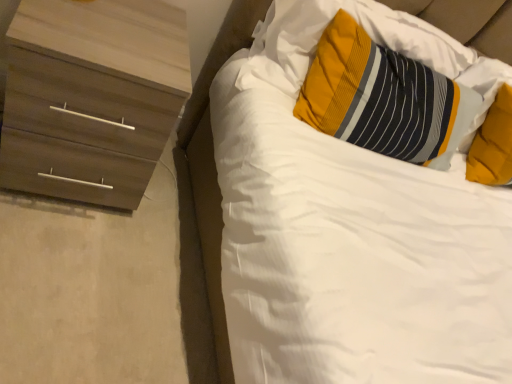
What do you see at coordinates (493, 144) in the screenshot? The width and height of the screenshot is (512, 384). I see `soft yellow pillow at upper right, which appears as the second pillow when viewed from the left` at bounding box center [493, 144].

Looking at this image, what is the approximate height of wooden chest of drawers at left?

wooden chest of drawers at left is 20.02 inches tall.

This screenshot has height=384, width=512. I want to click on white soft bed at upper right, so click(214, 164).

What do you see at coordinates (214, 164) in the screenshot?
I see `white soft bed at upper right` at bounding box center [214, 164].

Locate an element on the screen. The width and height of the screenshot is (512, 384). soft yellow pillow at upper right, which appears as the second pillow when viewed from the left is located at coordinates (493, 144).

How many degrees apart are the facing directions of soft yellow pillow at upper right, marked as the first pillow in a right-to-left arrangement, and white soft bed at upper right?

The angular difference between soft yellow pillow at upper right, marked as the first pillow in a right-to-left arrangement, and white soft bed at upper right is 5.76 degrees.

From a real-world perspective, between soft yellow pillow at upper right, which appears as the second pillow when viewed from the left, and white soft bed at upper right, who is vertically higher?

soft yellow pillow at upper right, which appears as the second pillow when viewed from the left, is physically above.

Is soft yellow pillow at upper right, marked as the first pillow in a right-to-left arrangement, facing away from white soft bed at upper right?

No.

Which object is more forward, soft yellow pillow at upper right, marked as the first pillow in a right-to-left arrangement, or white soft bed at upper right?

white soft bed at upper right is closer to the camera.

Which is in front, point (362, 78) or point (185, 143)?

The point (362, 78) is closer.

From a real-world perspective, is striped fabric pillow at upper right, which appears as the 1th pillow when viewed from the left, positioned under white soft bed at upper right based on gravity?

Actually, striped fabric pillow at upper right, which appears as the 1th pillow when viewed from the left, is physically above white soft bed at upper right in the real world.

Considering the relative sizes of striped fabric pillow at upper right, the second pillow when ordered from right to left, and white soft bed at upper right in the image provided, is striped fabric pillow at upper right, the second pillow when ordered from right to left, taller than white soft bed at upper right?

Incorrect, the height of striped fabric pillow at upper right, the second pillow when ordered from right to left, is not larger of that of white soft bed at upper right.

Considering the positions of objects striped fabric pillow at upper right, which appears as the 1th pillow when viewed from the left, and white soft bed at upper right in the image provided, who is more to the left, striped fabric pillow at upper right, which appears as the 1th pillow when viewed from the left, or white soft bed at upper right?

white soft bed at upper right.

Which point is more forward, (433, 92) or (480, 147)?

The point (433, 92) is closer to the camera.

How far apart are striped fabric pillow at upper right, which appears as the 1th pillow when viewed from the left, and soft yellow pillow at upper right, marked as the first pillow in a right-to-left arrangement?

A distance of 13.65 inches exists between striped fabric pillow at upper right, which appears as the 1th pillow when viewed from the left, and soft yellow pillow at upper right, marked as the first pillow in a right-to-left arrangement.

Consider the image. Is striped fabric pillow at upper right, which appears as the 1th pillow when viewed from the left, outside of soft yellow pillow at upper right, which appears as the second pillow when viewed from the left?

That's correct, striped fabric pillow at upper right, which appears as the 1th pillow when viewed from the left, is outside of soft yellow pillow at upper right, which appears as the second pillow when viewed from the left.

Which point is more forward, (73, 155) or (198, 87)?

The point (73, 155) is more forward.

Can you confirm if wooden chest of drawers at left is bigger than white soft bed at upper right?

Actually, wooden chest of drawers at left might be smaller than white soft bed at upper right.

Which is more to the right, wooden chest of drawers at left or white soft bed at upper right?

From the viewer's perspective, white soft bed at upper right appears more on the right side.

From the image's perspective, which one is positioned lower, wooden chest of drawers at left or white soft bed at upper right?

From the image's view, white soft bed at upper right is below.

Is white soft bed at upper right at the left side of soft yellow pillow at upper right, marked as the first pillow in a right-to-left arrangement?

Yes.

Does white soft bed at upper right come in front of soft yellow pillow at upper right, which appears as the second pillow when viewed from the left?

Yes, it is.

Is soft yellow pillow at upper right, which appears as the second pillow when viewed from the left, at the back of white soft bed at upper right?

No.

Is white soft bed at upper right completely or partially outside of soft yellow pillow at upper right, which appears as the second pillow when viewed from the left?

Indeed, white soft bed at upper right is completely outside soft yellow pillow at upper right, which appears as the second pillow when viewed from the left.

Which of these two, soft yellow pillow at upper right, which appears as the second pillow when viewed from the left, or wooden chest of drawers at left, is wider?

wooden chest of drawers at left is wider.

Does point (507, 101) lie in front of point (146, 135)?

No, (507, 101) is behind (146, 135).

Considering the sizes of objects soft yellow pillow at upper right, which appears as the second pillow when viewed from the left, and wooden chest of drawers at left in the image provided, who is taller, soft yellow pillow at upper right, which appears as the second pillow when viewed from the left, or wooden chest of drawers at left?

wooden chest of drawers at left is taller.

The height and width of the screenshot is (384, 512). In order to click on the chest of drawers in front of the soft yellow pillow at upper right, which appears as the second pillow when viewed from the left in this screenshot , I will do 91,97.

Is striped fabric pillow at upper right, which appears as the 1th pillow when viewed from the left, next to wooden chest of drawers at left?

No, striped fabric pillow at upper right, which appears as the 1th pillow when viewed from the left, is not in contact with wooden chest of drawers at left.

Can you confirm if striped fabric pillow at upper right, which appears as the 1th pillow when viewed from the left, is positioned to the left of wooden chest of drawers at left?

No, striped fabric pillow at upper right, which appears as the 1th pillow when viewed from the left, is not to the left of wooden chest of drawers at left.

Looking at this image, can you confirm if striped fabric pillow at upper right, which appears as the 1th pillow when viewed from the left, is bigger than wooden chest of drawers at left?

No, striped fabric pillow at upper right, which appears as the 1th pillow when viewed from the left, is not bigger than wooden chest of drawers at left.

How different are the orientations of striped fabric pillow at upper right, the second pillow when ordered from right to left, and wooden chest of drawers at left in degrees?

striped fabric pillow at upper right, the second pillow when ordered from right to left, and wooden chest of drawers at left are facing 4.76 degrees away from each other.

Where is `bed that appears below the soft yellow pillow at upper right, which appears as the second pillow when viewed from the left (from a real-world perspective)`? This screenshot has height=384, width=512. bed that appears below the soft yellow pillow at upper right, which appears as the second pillow when viewed from the left (from a real-world perspective) is located at coordinates coord(214,164).

Find the location of a particular element. Image resolution: width=512 pixels, height=384 pixels. bed on the left of striped fabric pillow at upper right, the second pillow when ordered from right to left is located at coordinates (214, 164).

Which object lies nearer to the anchor point soft yellow pillow at upper right, marked as the first pillow in a right-to-left arrangement, striped fabric pillow at upper right, the second pillow when ordered from right to left, or white soft bed at upper right?

Among the two, striped fabric pillow at upper right, the second pillow when ordered from right to left, is located nearer to soft yellow pillow at upper right, marked as the first pillow in a right-to-left arrangement.

Consider the image. Considering their positions, is soft yellow pillow at upper right, which appears as the second pillow when viewed from the left, positioned further to striped fabric pillow at upper right, the second pillow when ordered from right to left, than wooden chest of drawers at left?

wooden chest of drawers at left lies further to striped fabric pillow at upper right, the second pillow when ordered from right to left, than the other object.

Based on their spatial positions, is white soft bed at upper right or soft yellow pillow at upper right, which appears as the second pillow when viewed from the left, further from wooden chest of drawers at left?

soft yellow pillow at upper right, which appears as the second pillow when viewed from the left, is further to wooden chest of drawers at left.

Considering their positions, is soft yellow pillow at upper right, which appears as the second pillow when viewed from the left, positioned further to wooden chest of drawers at left than striped fabric pillow at upper right, the second pillow when ordered from right to left?

soft yellow pillow at upper right, which appears as the second pillow when viewed from the left, is further to wooden chest of drawers at left.

Estimate the real-world distances between objects in this image. Which object is closer to white soft bed at upper right, soft yellow pillow at upper right, which appears as the second pillow when viewed from the left, or striped fabric pillow at upper right, which appears as the 1th pillow when viewed from the left?

striped fabric pillow at upper right, which appears as the 1th pillow when viewed from the left, is closer to white soft bed at upper right.

Which object lies nearer to the anchor point white soft bed at upper right, striped fabric pillow at upper right, the second pillow when ordered from right to left, or wooden chest of drawers at left?

wooden chest of drawers at left.

When comparing their distances from soft yellow pillow at upper right, marked as the first pillow in a right-to-left arrangement, does white soft bed at upper right or wooden chest of drawers at left seem further?

wooden chest of drawers at left is further to soft yellow pillow at upper right, marked as the first pillow in a right-to-left arrangement.

Looking at the image, which one is located closer to striped fabric pillow at upper right, which appears as the 1th pillow when viewed from the left, wooden chest of drawers at left or soft yellow pillow at upper right, marked as the first pillow in a right-to-left arrangement?

soft yellow pillow at upper right, marked as the first pillow in a right-to-left arrangement, is positioned closer to the anchor striped fabric pillow at upper right, which appears as the 1th pillow when viewed from the left.

The image size is (512, 384). I want to click on pillow between white soft bed at upper right and soft yellow pillow at upper right, which appears as the second pillow when viewed from the left, in the front-back direction, so click(x=383, y=98).

The height and width of the screenshot is (384, 512). In order to click on bed between wooden chest of drawers at left and soft yellow pillow at upper right, marked as the first pillow in a right-to-left arrangement, from left to right in this screenshot , I will do `click(214, 164)`.

Where is `pillow situated between wooden chest of drawers at left and soft yellow pillow at upper right, marked as the first pillow in a right-to-left arrangement, from left to right`? This screenshot has width=512, height=384. pillow situated between wooden chest of drawers at left and soft yellow pillow at upper right, marked as the first pillow in a right-to-left arrangement, from left to right is located at coordinates (383, 98).

Locate an element on the screen. Image resolution: width=512 pixels, height=384 pixels. bed between wooden chest of drawers at left and striped fabric pillow at upper right, which appears as the 1th pillow when viewed from the left, from left to right is located at coordinates (214, 164).